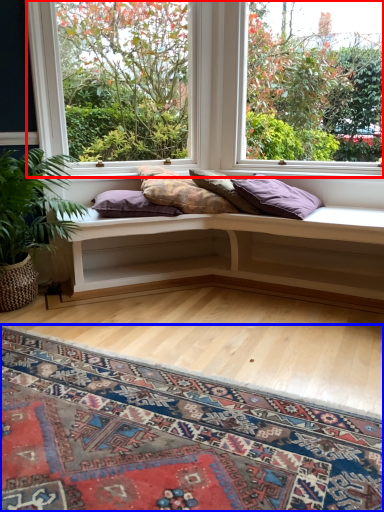
Question: Which object is closer to the camera taking this photo, window (highlighted by a red box) or mat (highlighted by a blue box)?

Choices:
 (A) window
 (B) mat

Answer: (B)